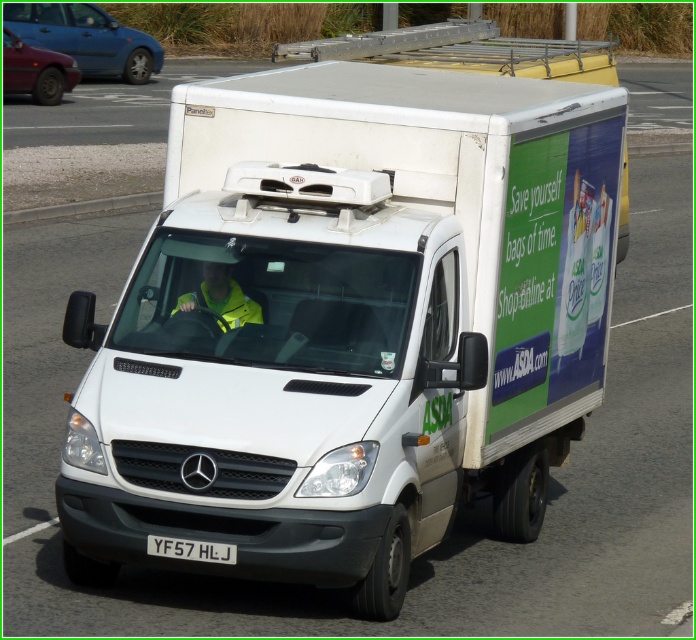
You are a pedestrian standing at the side of the road. You see the yellow reflective jacket at center and the white plastic license plate at lower center on the van. Which object is closer to the top of the van?

The yellow reflective jacket at center is located above the white plastic license plate at lower center, so it is closer to the top of the van.

You are a pedestrian standing on the sidewalk and see the metallic blue sedan at left and the yellow reflective jacket at center. Which object is closer to you?

The metallic blue sedan at left is closer to you because the yellow reflective jacket at center is behind it.

You are a pedestrian standing on the sidewalk next to the road where the white Mercedes Benz Sprinter van is driving. You notice two objects on the van. Which object would appear bigger to you between the yellow reflective jacket at center and the white plastic license plate at lower center?

The yellow reflective jacket at center appears bigger than the white plastic license plate at lower center because it is larger in size according to the description.